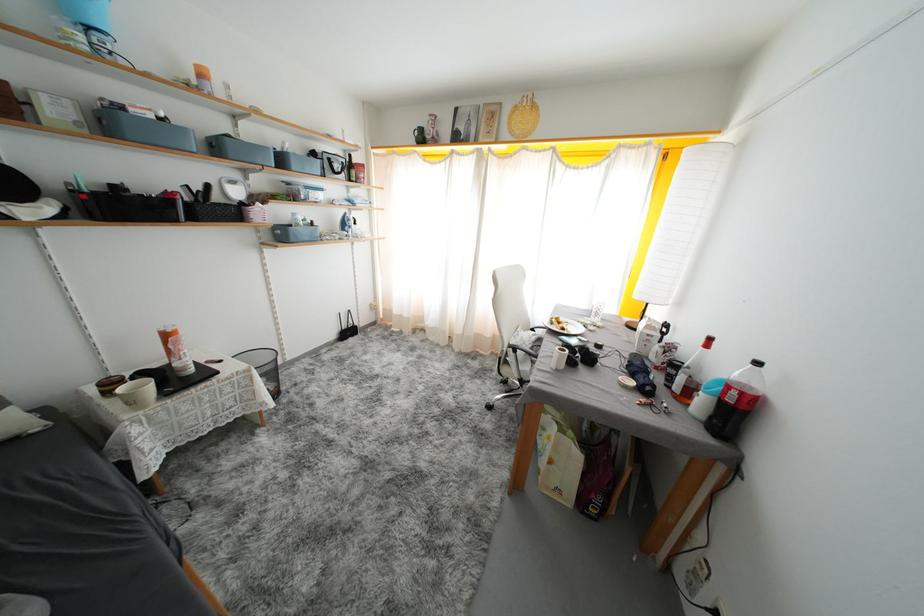
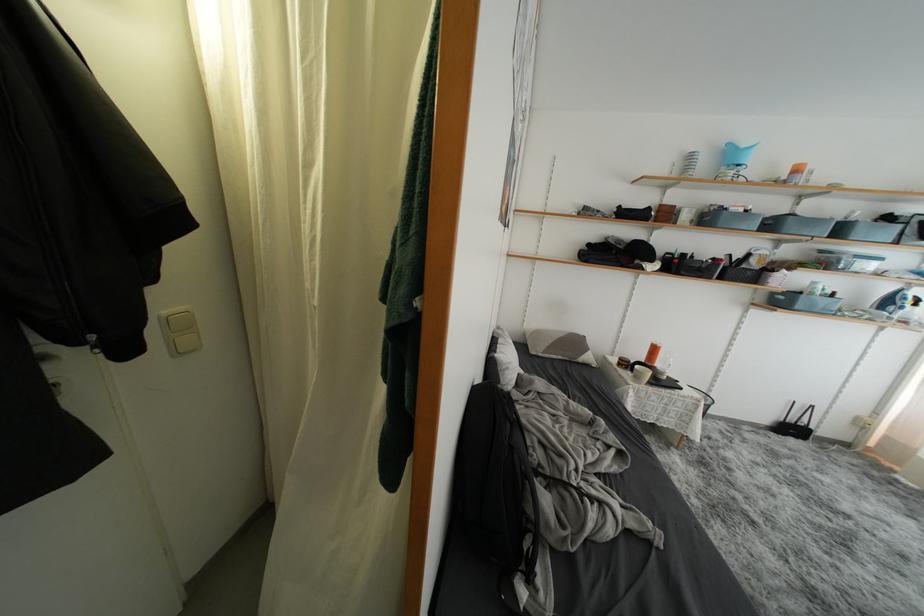
Where in the second image is the point corresponding to (x=223, y=151) from the first image?

(777, 229)